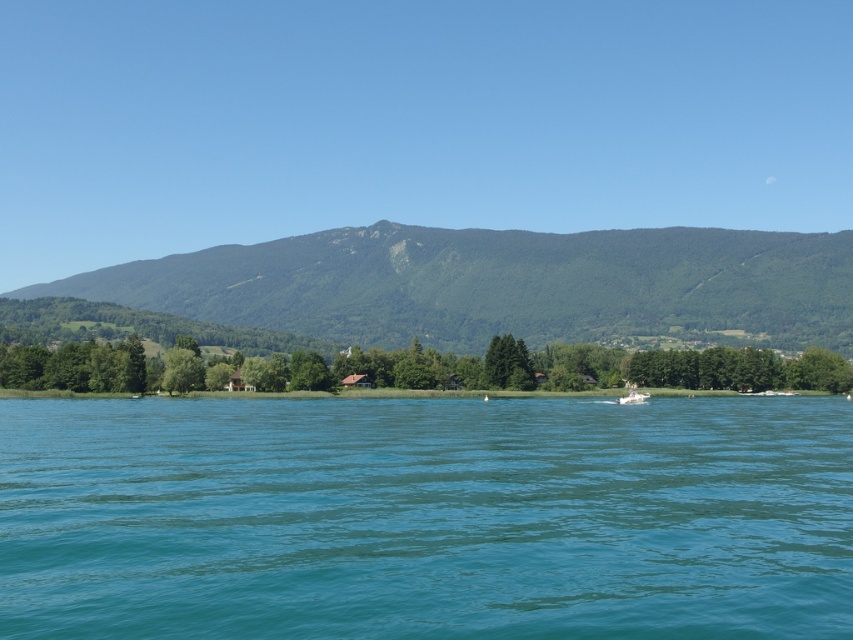
Question: Among these points, which one is nearest to the camera?

Choices:
 (A) (495, 237)
 (B) (622, 401)

Answer: (B)

Question: Can you confirm if green leafy trees at center is positioned to the left of white plastic boat at center?

Choices:
 (A) no
 (B) yes

Answer: (B)

Question: Can you confirm if teal smooth water at center is wider than white plastic boat at center?

Choices:
 (A) no
 (B) yes

Answer: (B)

Question: Which of the following is the farthest from the observer?

Choices:
 (A) (120, 344)
 (B) (833, 436)
 (C) (630, 396)

Answer: (A)

Question: Is teal smooth water at center above green textured mountain at upper center?

Choices:
 (A) yes
 (B) no

Answer: (B)

Question: Which point is farther from the camera taking this photo?

Choices:
 (A) (445, 428)
 (B) (640, 394)
 (C) (831, 310)
 (D) (451, 368)

Answer: (C)